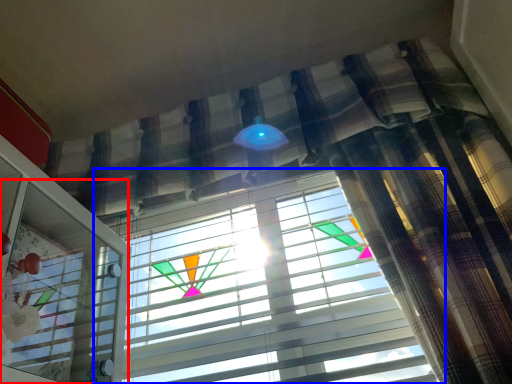
Question: Which object appears farthest to the camera in this image, screen door (highlighted by a red box) or window blind (highlighted by a blue box)?

Choices:
 (A) screen door
 (B) window blind

Answer: (B)